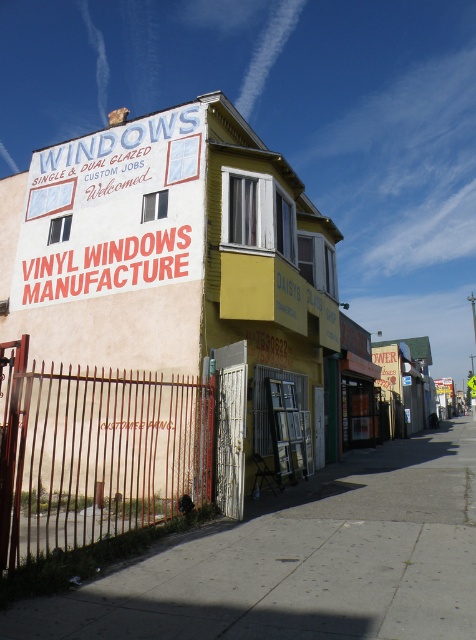
Which is behind, point (436, 476) or point (184, 243)?

The point (436, 476) is behind.

Who is more forward, (255, 532) or (128, 228)?

Positioned in front is point (255, 532).

Image resolution: width=476 pixels, height=640 pixels. Describe the element at coordinates (301, 561) in the screenshot. I see `concrete sidewalk at lower center` at that location.

Where is `concrete sidewalk at lower center`? This screenshot has width=476, height=640. concrete sidewalk at lower center is located at coordinates (301, 561).

Is point (48, 289) in front of point (105, 200)?

No, (48, 289) is behind (105, 200).

Who is lower down, beige painted wall at center or white vinyl sign at upper center?

beige painted wall at center is below.

Looking at this image, measure the distance between beige painted wall at center and camera.

25.92 feet

This screenshot has width=476, height=640. Find the location of `beige painted wall at center`. beige painted wall at center is located at coordinates (178, 266).

Can you confirm if beige painted wall at center is taller than concrete sidewalk at lower center?

Yes.

Where is `beige painted wall at center`? Image resolution: width=476 pixels, height=640 pixels. beige painted wall at center is located at coordinates click(178, 266).